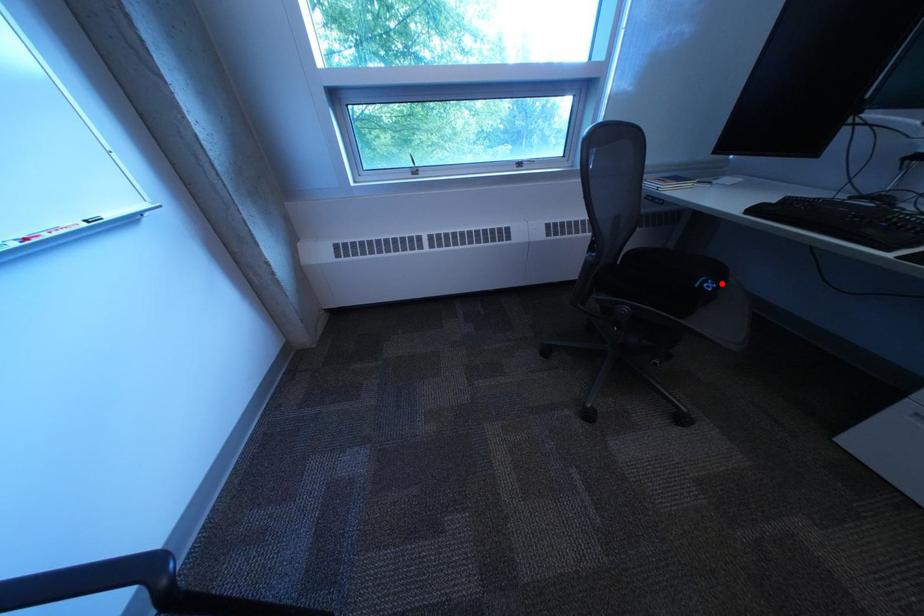
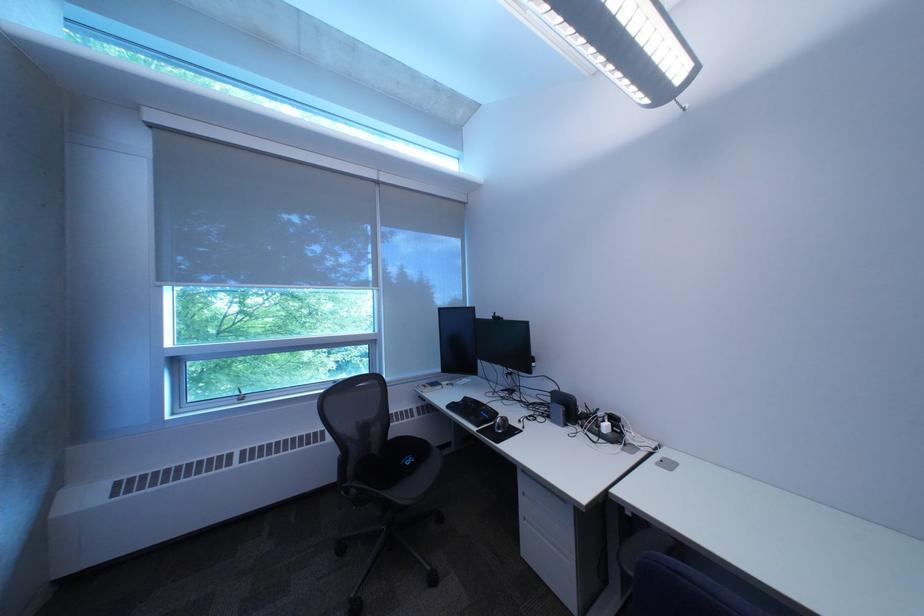
Where in the second image is the point corresponding to the highlighted location from the first image?

(423, 461)